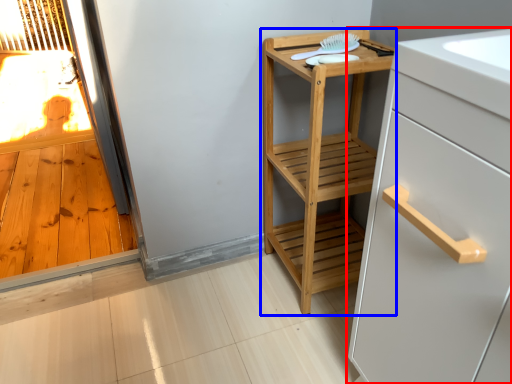
Question: Which object appears farthest to the camera in this image, cabinetry (highlighted by a red box) or furniture (highlighted by a blue box)?

Choices:
 (A) cabinetry
 (B) furniture

Answer: (B)